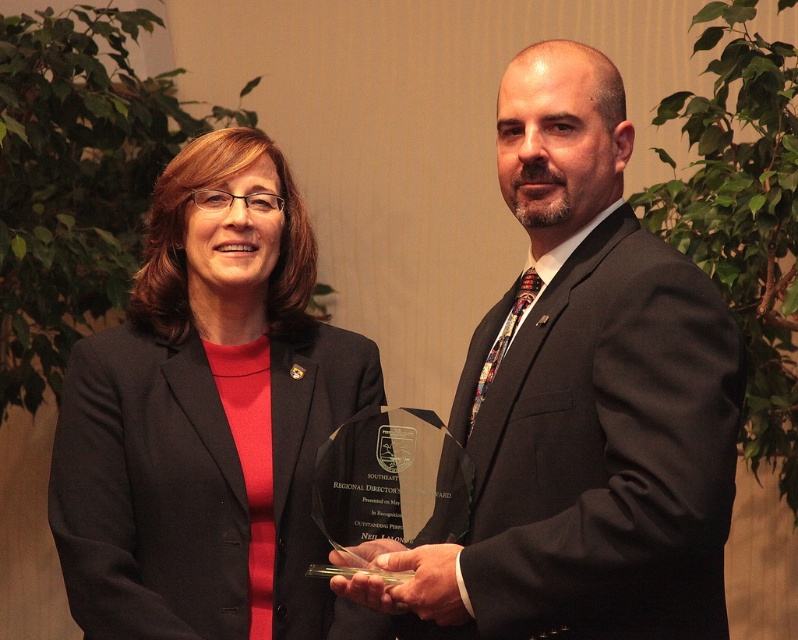
You are at an event and need to determine the position of two black items. You see a matte black suit at center and a matte black blazer at center. Which one is located higher?

The matte black suit at center is above the matte black blazer at center.

Based on the scene description, which object is taller between the matte black suit at center and the matte black blazer at center?

The matte black suit at center is much taller than the matte black blazer at center.